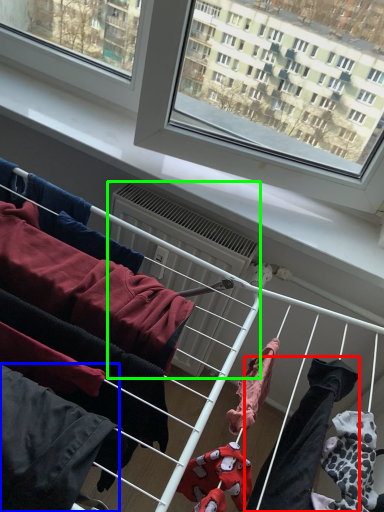
Question: Which object is the closest to the clothing (highlighted by a red box)? Choose among these: clothing (highlighted by a blue box) or air conditioner (highlighted by a green box).

Choices:
 (A) clothing
 (B) air conditioner

Answer: (A)